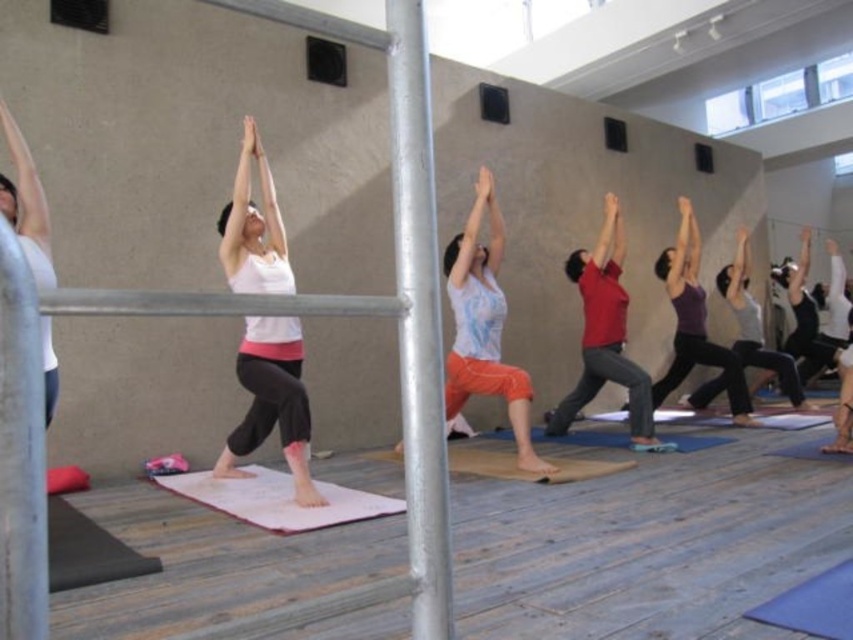
You are a photographer trying to capture a closeup of the matte white tank top at center and the purple matte leggings at center. Since you want to focus on the top, should you adjust your camera to focus higher or lower?

The matte white tank top at center is above the purple matte leggings at center, so you should adjust your camera to focus higher to capture the matte white tank top at center properly.

You are a photographer taking a picture of the yoga class. You notice the light blue cotton shirt at center and the pink fabric yoga mat at center. Which object should you focus on first if you want to capture the taller one in the frame?

The light blue cotton shirt at center is taller than the pink fabric yoga mat at center, so you should focus on the light blue cotton shirt at center first to capture the taller object in the frame.

You are standing in the yoga room and want to move from the point at coordinates point (28, 262) to the point at coordinates point (387, 451). Which direction should you face to move towards the second point?

Since point (28, 262) is in front of point (387, 451), you should face backward to move from point (28, 262) towards point (387, 451).